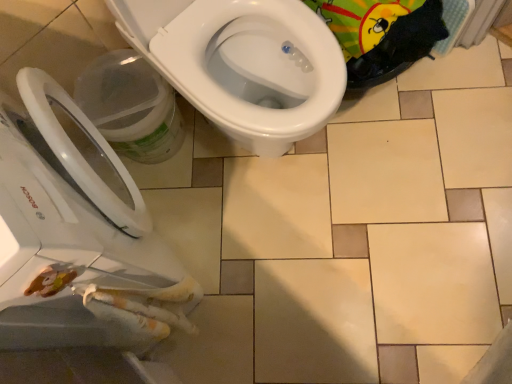
Question: Can you confirm if transparent plastic bucket at lower left is positioned to the left of white glossy bidet at center?

Choices:
 (A) no
 (B) yes

Answer: (B)

Question: Is transparent plastic bucket at lower left wider than white glossy bidet at center?

Choices:
 (A) yes
 (B) no

Answer: (B)

Question: Does transparent plastic bucket at lower left appear on the right side of white glossy bidet at center?

Choices:
 (A) no
 (B) yes

Answer: (A)

Question: Is transparent plastic bucket at lower left smaller than white glossy bidet at center?

Choices:
 (A) no
 (B) yes

Answer: (B)

Question: From the image's perspective, is transparent plastic bucket at lower left located beneath white glossy bidet at center?

Choices:
 (A) yes
 (B) no

Answer: (A)

Question: Based on their sizes in the image, would you say transparent plastic bucket at lower left is bigger or smaller than white glossy toilet at upper center?

Choices:
 (A) big
 (B) small

Answer: (B)

Question: Is transparent plastic bucket at lower left wider or thinner than white glossy toilet at upper center?

Choices:
 (A) thin
 (B) wide

Answer: (A)

Question: From the image's perspective, is transparent plastic bucket at lower left positioned above or below white glossy toilet at upper center?

Choices:
 (A) below
 (B) above

Answer: (B)

Question: Considering the positions of point (163, 92) and point (118, 339), is point (163, 92) closer or farther from the camera than point (118, 339)?

Choices:
 (A) farther
 (B) closer

Answer: (A)

Question: Would you say white glossy bidet at center is to the left or to the right of transparent plastic bucket at lower left in the picture?

Choices:
 (A) right
 (B) left

Answer: (A)

Question: From the image's perspective, is white glossy bidet at center positioned above or below transparent plastic bucket at lower left?

Choices:
 (A) above
 (B) below

Answer: (A)

Question: Considering the positions of white glossy bidet at center and transparent plastic bucket at lower left in the image, is white glossy bidet at center taller or shorter than transparent plastic bucket at lower left?

Choices:
 (A) tall
 (B) short

Answer: (A)

Question: In terms of size, does white glossy bidet at center appear bigger or smaller than transparent plastic bucket at lower left?

Choices:
 (A) big
 (B) small

Answer: (A)

Question: In the image, is white glossy toilet at upper center positioned in front of or behind white glossy bidet at center?

Choices:
 (A) front
 (B) behind

Answer: (A)

Question: In terms of size, does white glossy toilet at upper center appear bigger or smaller than white glossy bidet at center?

Choices:
 (A) small
 (B) big

Answer: (B)